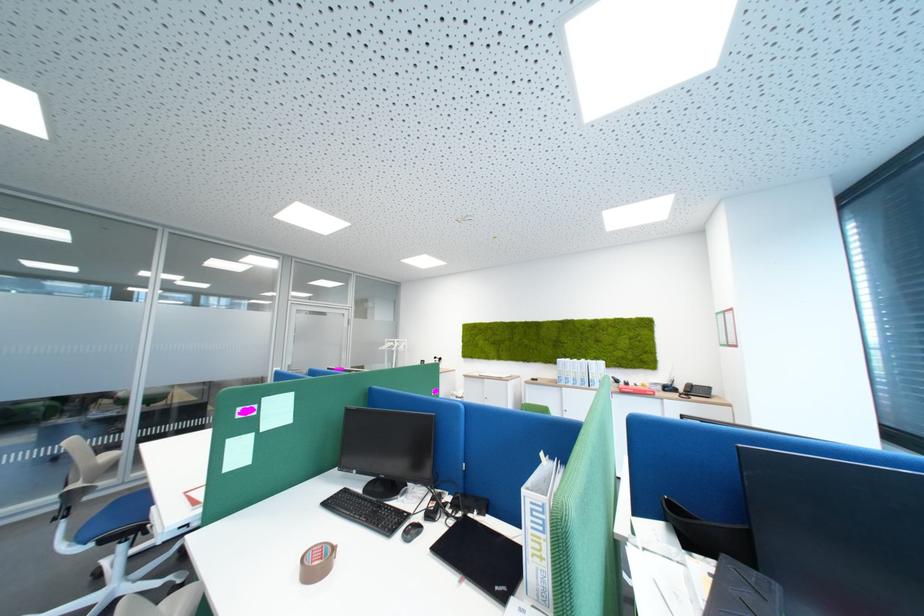
The width and height of the screenshot is (924, 616). Describe the element at coordinates (696, 391) in the screenshot. I see `the telephone handset` at that location.